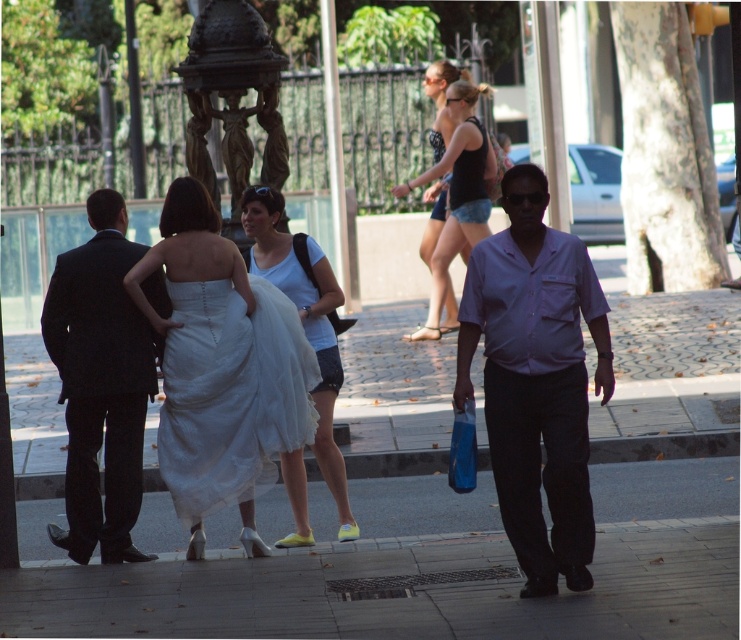
You are standing at the center of the pedestrian area and want to find the purple cotton shirt at center. According to the coordinates provided, in which direction should you look to locate it?

The purple cotton shirt at center is located at coordinates point (536, 380), which means it is positioned slightly to the right and above the center point. You should look towards the upper right direction from the center to find it.

What is the color of the clothing item located at the coordinates point [536,380]?

The point [536,380] marks the purple cotton shirt at center, so the color is purple.